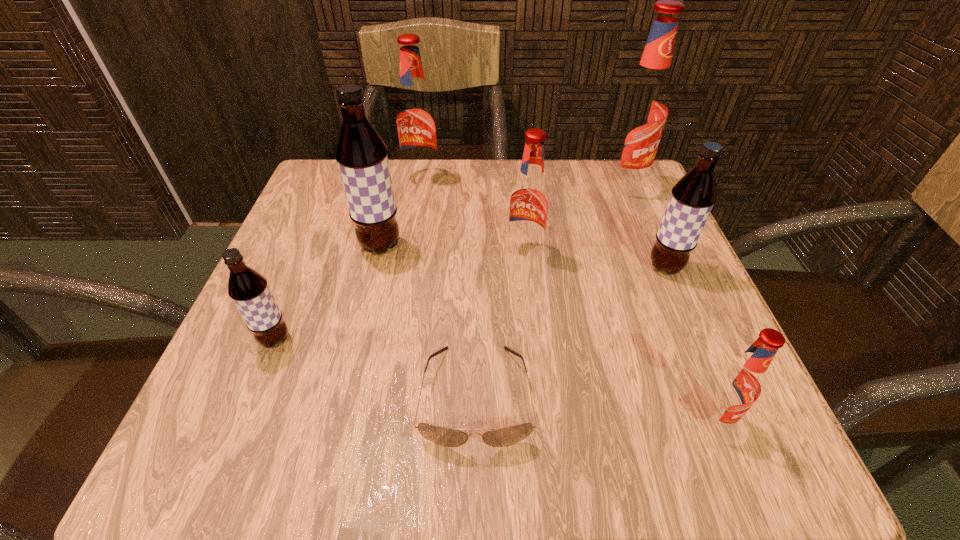
Select which object appears as the fourth closest to the tallest root beer. Please provide its 2D coordinates. Your answer should be formatted as a tuple, i.e. [(x, y)], where the tuple contains the x and y coordinates of a point satisfying the conditions above.

[(361, 155)]

Identify the location of root beer that is the fifth closest to the third farthest red root beer. (738, 384).

Locate which root beer is the fourth closest to the smallest red root beer. Please provide its 2D coordinates. Your answer should be formatted as a tuple, i.e. [(x, y)], where the tuple contains the x and y coordinates of a point satisfying the conditions above.

[(361, 155)]

I want to click on red root beer identified as the closest to the third red root beer from right to left, so click(x=641, y=113).

Locate an element on the screen. The height and width of the screenshot is (540, 960). the third closest red root beer relative to the second red root beer from left to right is located at coordinates (738, 384).

Identify which brown root beer is located as the second nearest to the nearest root beer. Please provide its 2D coordinates. Your answer should be formatted as a tuple, i.e. [(x, y)], where the tuple contains the x and y coordinates of a point satisfying the conditions above.

[(361, 155)]

This screenshot has width=960, height=540. Find the location of `brown root beer identified as the second closest to the biggest brown root beer`. brown root beer identified as the second closest to the biggest brown root beer is located at coordinates (693, 196).

At what (x,y) coordinates should I click in order to perform the action: click on free space that satisfies the following two spatial constraints: 1. on the front side of the rightmost brown root beer; 2. on the right side of the biggest brown root beer. Please return your answer as a coordinate pair (x, y). The height and width of the screenshot is (540, 960). Looking at the image, I should click on (375, 267).

Identify the location of free location that satisfies the following two spatial constraints: 1. on the front side of the leftmost red root beer; 2. on the left side of the nearest red root beer. (383, 419).